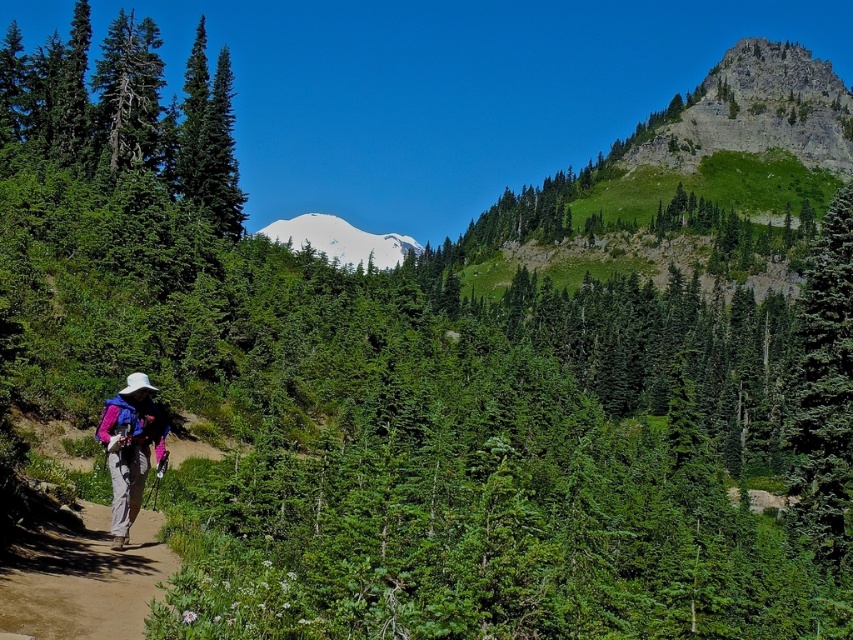
You are a hiker standing at the camera position in the forest scene. You want to reach a specific point marked at coordinates point (148,412). Considering your average walking speed is 5 km per hour, how many minutes will it take you to reach that point?

The distance between the camera and point (148,412) is 39.22 meters. Converting 5 km per hour to meters per minute gives approximately 83.33 meters per minute. Dividing the distance by speed, 39.22 divided by 83.33 equals roughly 0.47 minutes, which is about 28 seconds. Therefore, it will take approximately 0.5 minutes to reach the point.

You are a hiker standing at the starting point of the trail. You see two points marked on your map corresponding to coordinates point (834, 296) and point (15, 632). Which point is closer to your current position?

Point (834, 296) is closer to your current position because it is further to the viewer than point (15, 632).